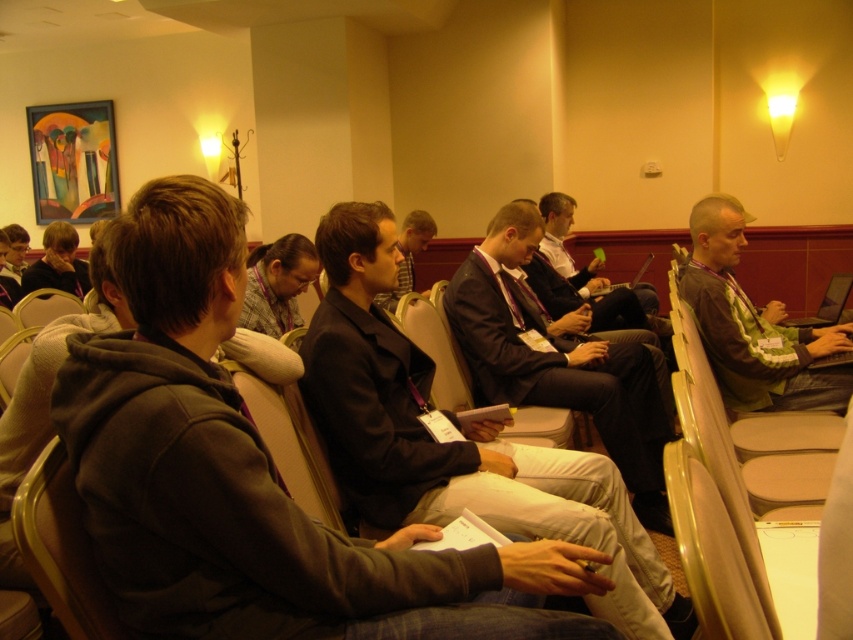
Can you confirm if matte black jacket at center is shorter than light brown leather chair at left?

No.

Does matte black jacket at center appear over light brown leather chair at left?

Correct, matte black jacket at center is located above light brown leather chair at left.

The image size is (853, 640). In order to click on matte black jacket at center in this screenshot , I will do `click(408, 256)`.

Image resolution: width=853 pixels, height=640 pixels. I want to click on matte black jacket at center, so click(x=408, y=256).

Does point (283, 605) lie behind point (405, 236)?

No, it is not.

Can you confirm if dark gray hoodie at center is wider than matte black jacket at center?

Indeed, dark gray hoodie at center has a greater width compared to matte black jacket at center.

This screenshot has height=640, width=853. Identify the location of dark gray hoodie at center. (251, 476).

This screenshot has height=640, width=853. In order to click on dark gray hoodie at center in this screenshot , I will do `click(251, 476)`.

Which is behind, point (469, 257) or point (68, 300)?

Point (68, 300)

Does dark suit at center appear on the left side of light brown leather chair at left?

In fact, dark suit at center is to the right of light brown leather chair at left.

Is point (616, 380) positioned before point (32, 312)?

That is True.

Image resolution: width=853 pixels, height=640 pixels. What are the coordinates of `dark suit at center` in the screenshot? It's located at (556, 360).